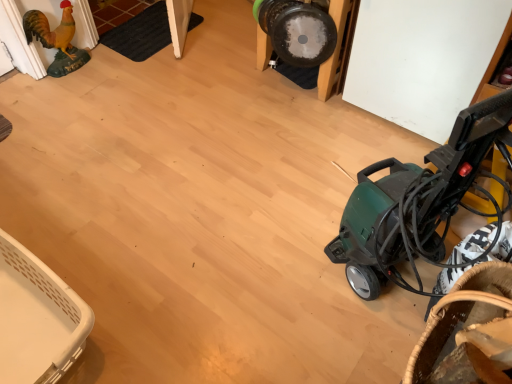
Question: Considering the relative sizes of white plastic basket at lower left, the second basket in the front-to-back sequence, and golden matte chicken at left in the image provided, is white plastic basket at lower left, the second basket in the front-to-back sequence, smaller than golden matte chicken at left?

Choices:
 (A) no
 (B) yes

Answer: (A)

Question: Is white plastic basket at lower left, the second basket in the front-to-back sequence, positioned far away from golden matte chicken at left?

Choices:
 (A) no
 (B) yes

Answer: (B)

Question: From the image's perspective, does white plastic basket at lower left, which is counted as the first basket, starting from the left, appear higher than golden matte chicken at left?

Choices:
 (A) no
 (B) yes

Answer: (A)

Question: Is golden matte chicken at left at the back of white plastic basket at lower left, the 1th basket in the back-to-front sequence?

Choices:
 (A) no
 (B) yes

Answer: (A)

Question: Is white plastic basket at lower left, the 1th basket in the back-to-front sequence, behind golden matte chicken at left?

Choices:
 (A) yes
 (B) no

Answer: (B)

Question: Is white plastic basket at lower left, the second basket in the front-to-back sequence, wider than golden matte chicken at left?

Choices:
 (A) yes
 (B) no

Answer: (A)

Question: Is white plastic basket at lower left, the 1th basket in the back-to-front sequence, oriented away from green plastic vacuum cleaner at right?

Choices:
 (A) yes
 (B) no

Answer: (B)

Question: Are white plastic basket at lower left, which is counted as the first basket, starting from the left, and green plastic vacuum cleaner at right beside each other?

Choices:
 (A) no
 (B) yes

Answer: (A)

Question: Can you confirm if white plastic basket at lower left, the 1th basket in the back-to-front sequence, is positioned to the left of green plastic vacuum cleaner at right?

Choices:
 (A) yes
 (B) no

Answer: (A)

Question: From the image's perspective, is white plastic basket at lower left, the 1th basket in the back-to-front sequence, under green plastic vacuum cleaner at right?

Choices:
 (A) yes
 (B) no

Answer: (A)

Question: From a real-world perspective, is white plastic basket at lower left, the 1th basket in the back-to-front sequence, physically below green plastic vacuum cleaner at right?

Choices:
 (A) yes
 (B) no

Answer: (A)

Question: Does white plastic basket at lower left, the second basket when ordered from right to left, lie in front of green plastic vacuum cleaner at right?

Choices:
 (A) yes
 (B) no

Answer: (B)

Question: Is green plastic vacuum cleaner at right positioned before white plastic basket at lower left, the second basket when ordered from right to left?

Choices:
 (A) yes
 (B) no

Answer: (A)